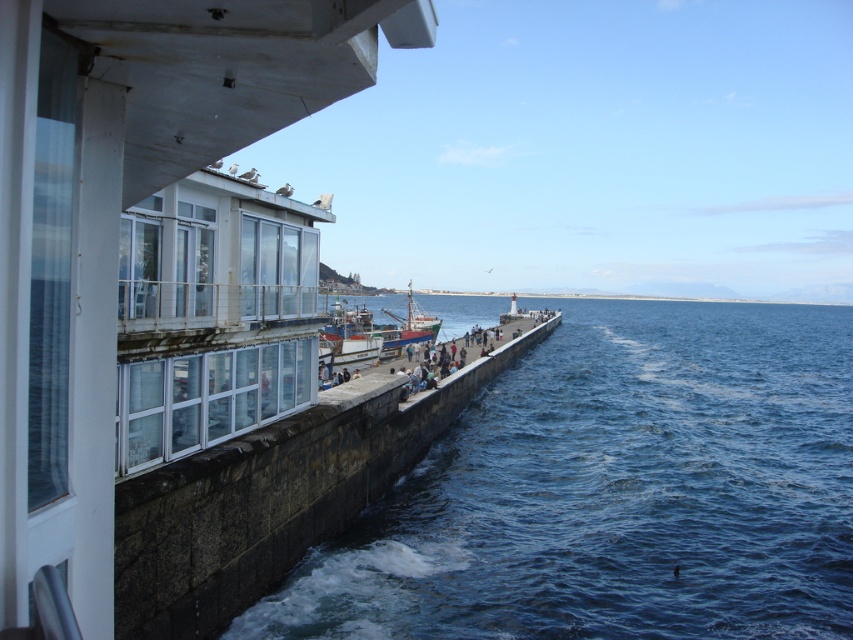
Question: Where is blue water at center located in relation to wooden boat at center in the image?

Choices:
 (A) left
 (B) right

Answer: (B)

Question: Which object appears closest to the camera in this image?

Choices:
 (A) wooden fishing boat at center
 (B) wooden boat at center
 (C) dark blue fabric people at center

Answer: (B)

Question: Which point is closer to the camera?

Choices:
 (A) (566, 516)
 (B) (366, 339)
 (C) (167, 595)

Answer: (C)

Question: Can you confirm if stone concrete ledge at center is positioned below dark blue fabric people at center?

Choices:
 (A) yes
 (B) no

Answer: (A)

Question: Which object is closer to the camera taking this photo?

Choices:
 (A) blue water at center
 (B) stone concrete ledge at center
 (C) dark blue fabric people at center
 (D) wooden boat at center

Answer: (B)

Question: Is wooden boat at center above wooden ship at center?

Choices:
 (A) no
 (B) yes

Answer: (A)